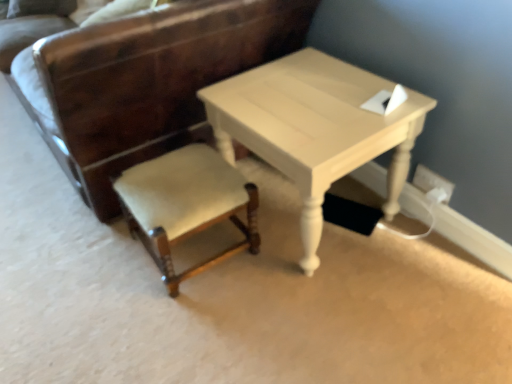
Locate an element on the screen. The image size is (512, 384). vacant space in front of light beige wood table at center is located at coordinates [329, 319].